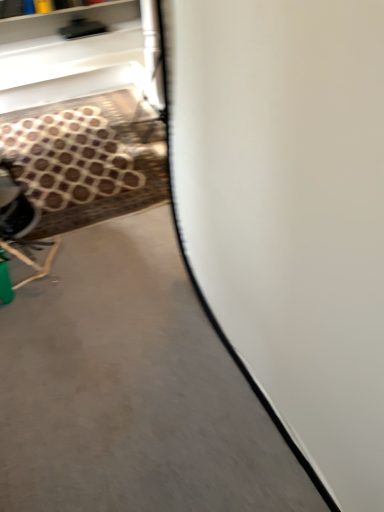
Question: Is gray concrete at center surrounding brown patterned carpet at lower left?

Choices:
 (A) yes
 (B) no

Answer: (A)

Question: Is gray concrete at center completely or partially outside of brown patterned carpet at lower left?

Choices:
 (A) no
 (B) yes

Answer: (B)

Question: Is gray concrete at center at the left side of brown patterned carpet at lower left?

Choices:
 (A) no
 (B) yes

Answer: (A)

Question: Does gray concrete at center appear on the right side of brown patterned carpet at lower left?

Choices:
 (A) no
 (B) yes

Answer: (B)

Question: Is gray concrete at center closer to the viewer compared to brown patterned carpet at lower left?

Choices:
 (A) yes
 (B) no

Answer: (A)

Question: From the image's perspective, does gray concrete at center appear lower than brown patterned carpet at lower left?

Choices:
 (A) yes
 (B) no

Answer: (A)

Question: Does brown patterned carpet at lower left have a lesser width compared to gray concrete at center?

Choices:
 (A) yes
 (B) no

Answer: (A)

Question: Considering the relative sizes of brown patterned carpet at lower left and gray concrete at center in the image provided, is brown patterned carpet at lower left smaller than gray concrete at center?

Choices:
 (A) no
 (B) yes

Answer: (B)

Question: From a real-world perspective, is brown patterned carpet at lower left on top of gray concrete at center?

Choices:
 (A) yes
 (B) no

Answer: (A)

Question: Can you confirm if brown patterned carpet at lower left is bigger than gray concrete at center?

Choices:
 (A) no
 (B) yes

Answer: (A)

Question: From the image's perspective, is brown patterned carpet at lower left under gray concrete at center?

Choices:
 (A) yes
 (B) no

Answer: (B)

Question: Is brown patterned carpet at lower left far from gray concrete at center?

Choices:
 (A) yes
 (B) no

Answer: (A)

Question: Is point (33, 449) closer or farther from the camera than point (77, 203)?

Choices:
 (A) closer
 (B) farther

Answer: (A)